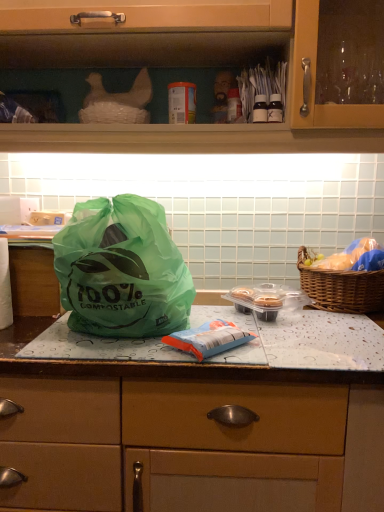
I want to click on vacant area that is situated to the right of blue matte plastic bag at center, arranged as the 2th food when viewed from the top, so pyautogui.click(x=291, y=345).